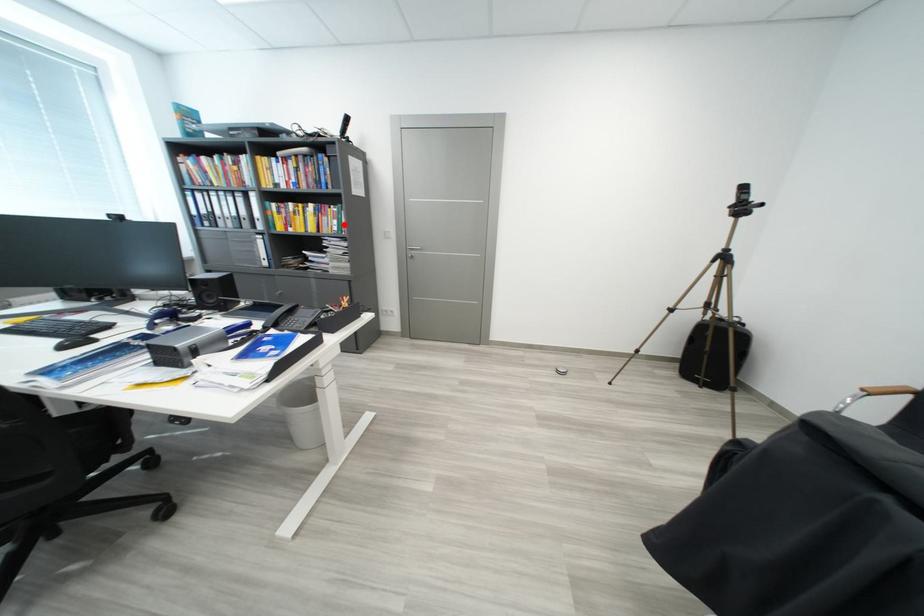
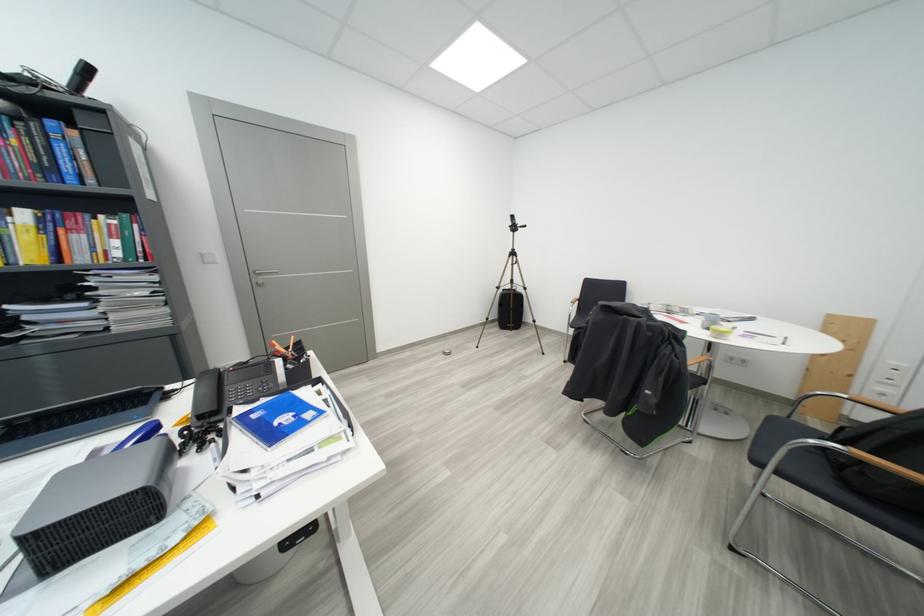
In the second image, find the point that corresponds to the highlighted location in the first image.

(126, 245)